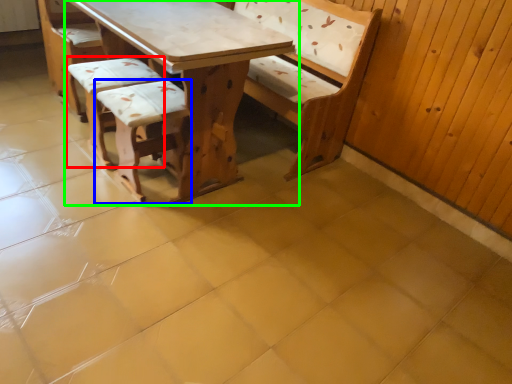
Question: Which object is positioned closest to armchair (highlighted by a red box)? Select from armchair (highlighted by a blue box) and table (highlighted by a green box).

Choices:
 (A) armchair
 (B) table

Answer: (A)